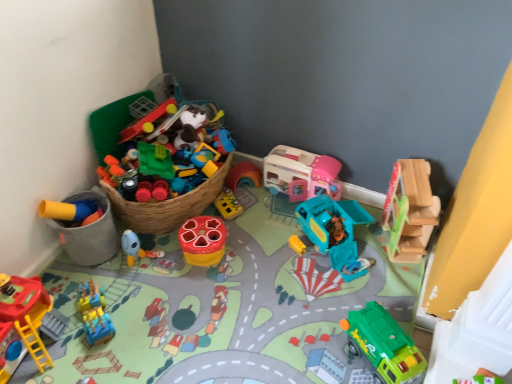
Where is `vacant space that is in between green matte truck at lower right, arranged as the second toy when viewed from the right, and blue rubber duck at center, which is the 3th toy in left-to-right order`? The width and height of the screenshot is (512, 384). vacant space that is in between green matte truck at lower right, arranged as the second toy when viewed from the right, and blue rubber duck at center, which is the 3th toy in left-to-right order is located at coordinates (258, 307).